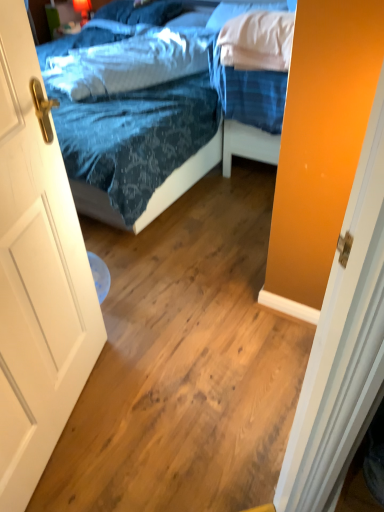
Locate an element on the screen. This screenshot has height=512, width=384. free spot in front of white wooden door at left is located at coordinates (79, 474).